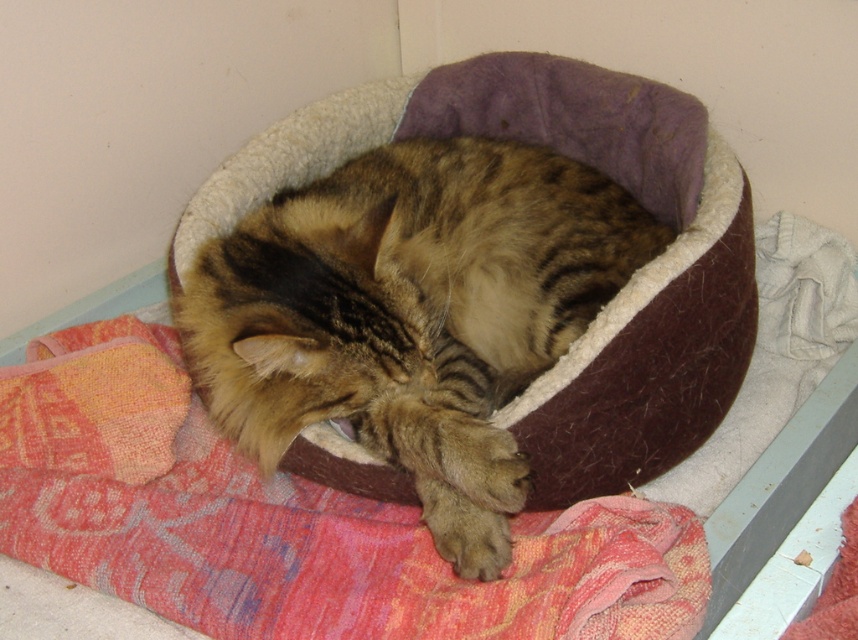
Question: Among these points, which one is nearest to the camera?

Choices:
 (A) (343, 397)
 (B) (71, 333)

Answer: (A)

Question: Is tabby fur cat at center smaller than textured pink fabric at lower center?

Choices:
 (A) yes
 (B) no

Answer: (B)

Question: Can you confirm if tabby fur cat at center is positioned below textured pink fabric at lower center?

Choices:
 (A) yes
 (B) no

Answer: (B)

Question: Can you confirm if tabby fur cat at center is positioned above textured pink fabric at lower center?

Choices:
 (A) no
 (B) yes

Answer: (B)